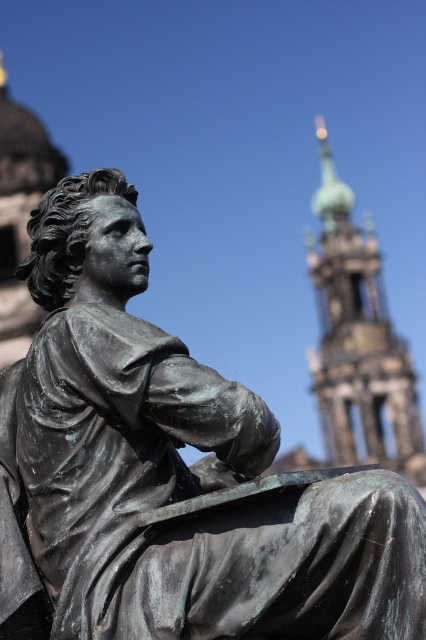
You are a photographer standing at the camera position. You want to take a photo of the bronze statue at center. The statue is 16.53 meters away from you. Your camera has a focal length of 50mm. To ensure the statue fills the frame, you need to calculate the minimum distance you should be from the statue. Assume the statue is 2 meters tall and your camera sensor has a height of 24mm. What is the closest distance you can stand to still capture the entire statue in the frame?

The bronze statue at center is 16.53 meters away from the camera. To calculate the minimum distance needed to fill the frame, use the formula distance_to_subject divided by sensor_height multiplied by subject_height. Plugging in the values, 16.53 meters divided by 24mm multiplied by 2 meters equals approximately 13.77 meters. Therefore, you can move closer to about 13.77 meters to still capture the entire statue within the frame.

You are standing in a park and see the bronze statue at center and the green copper tower at upper right. Which object is positioned more to the east if the sun is setting in the west?

The bronze statue at center is positioned more to the east because it is to the left of the green copper tower at upper right, and since the sun is setting in the west, left would correspond to the east direction.

You are standing in front of the bronze statue at center. If you want to take a photo of the statue with the grand cathedral spire in the background, where should you position yourself relative to the statue to ensure the spire is fully visible in the frame?

Since the bronze statue at center is located at coordinates approximately 0.739 on the horizontal axis and 0.399 on the vertical axis, positioning yourself to the left side of the statue would allow the grand cathedral spire, which is situated behind and to the right, to be fully captured in the photo frame.